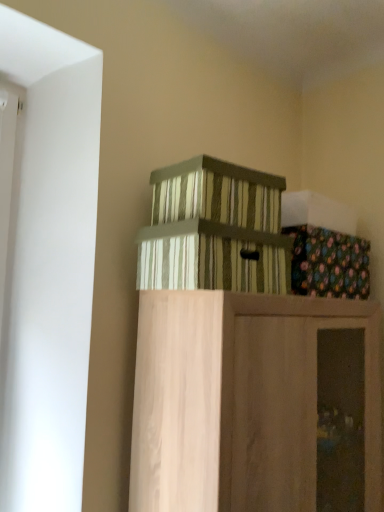
Question: Is floral fabric box at upper right positioned beyond the bounds of striped cardboard box at center, which is the 2th crate from top to bottom?

Choices:
 (A) no
 (B) yes

Answer: (B)

Question: Can you confirm if floral fabric box at upper right is shorter than striped cardboard box at center, placed as the first crate when sorted from bottom to top?

Choices:
 (A) yes
 (B) no

Answer: (A)

Question: Can you confirm if floral fabric box at upper right is positioned to the left of striped cardboard box at center, placed as the first crate when sorted from bottom to top?

Choices:
 (A) yes
 (B) no

Answer: (B)

Question: Is floral fabric box at upper right thinner than striped cardboard box at center, which is the 2th crate from top to bottom?

Choices:
 (A) yes
 (B) no

Answer: (A)

Question: Is floral fabric box at upper right wider than striped cardboard box at center, placed as the first crate when sorted from bottom to top?

Choices:
 (A) no
 (B) yes

Answer: (A)

Question: Is floral fabric box at upper right positioned in front of striped cardboard box at center, placed as the first crate when sorted from bottom to top?

Choices:
 (A) yes
 (B) no

Answer: (B)

Question: Is floral fabric box at upper right placed right next to wooden cabinet at upper center?

Choices:
 (A) yes
 (B) no

Answer: (B)

Question: Is floral fabric box at upper right not inside wooden cabinet at upper center?

Choices:
 (A) no
 (B) yes

Answer: (B)

Question: Considering the relative positions of floral fabric box at upper right and wooden cabinet at upper center in the image provided, is floral fabric box at upper right to the right of wooden cabinet at upper center from the viewer's perspective?

Choices:
 (A) no
 (B) yes

Answer: (B)

Question: Is the position of floral fabric box at upper right more distant than that of wooden cabinet at upper center?

Choices:
 (A) no
 (B) yes

Answer: (B)

Question: Can you confirm if floral fabric box at upper right is positioned to the left of wooden cabinet at upper center?

Choices:
 (A) yes
 (B) no

Answer: (B)

Question: From the image's perspective, is floral fabric box at upper right beneath wooden cabinet at upper center?

Choices:
 (A) no
 (B) yes

Answer: (A)

Question: Could you tell me if striped cardboard box at center, placed as the first crate when sorted from bottom to top, is facing floral fabric box at upper right?

Choices:
 (A) no
 (B) yes

Answer: (A)